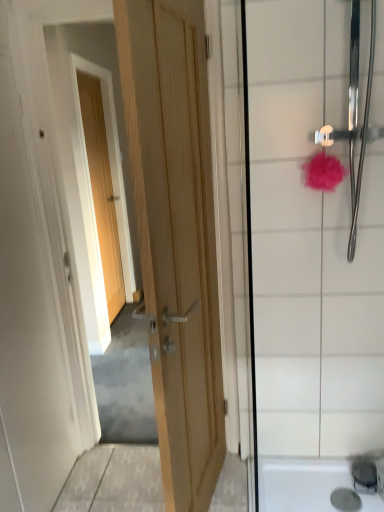
Image resolution: width=384 pixels, height=512 pixels. In order to click on vacant space that's between satin nickel faucet at lower right and white glossy shower door at right in this screenshot , I will do `click(317, 472)`.